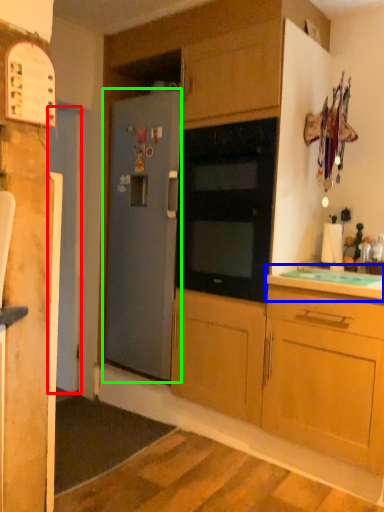
Question: Based on their relative distances, which object is farther from door (highlighted by a red box)? Choose from countertop (highlighted by a blue box) and refrigerator (highlighted by a green box).

Choices:
 (A) countertop
 (B) refrigerator

Answer: (A)